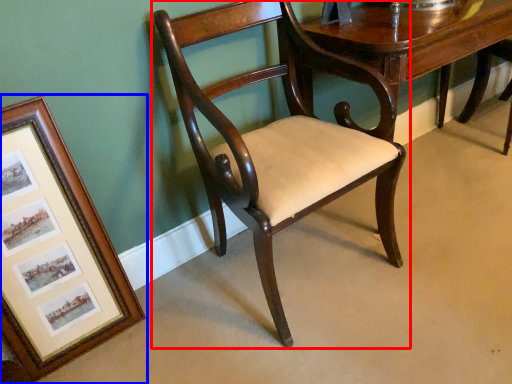
Question: Which object is further to the camera taking this photo, chair (highlighted by a red box) or picture frame (highlighted by a blue box)?

Choices:
 (A) chair
 (B) picture frame

Answer: (B)